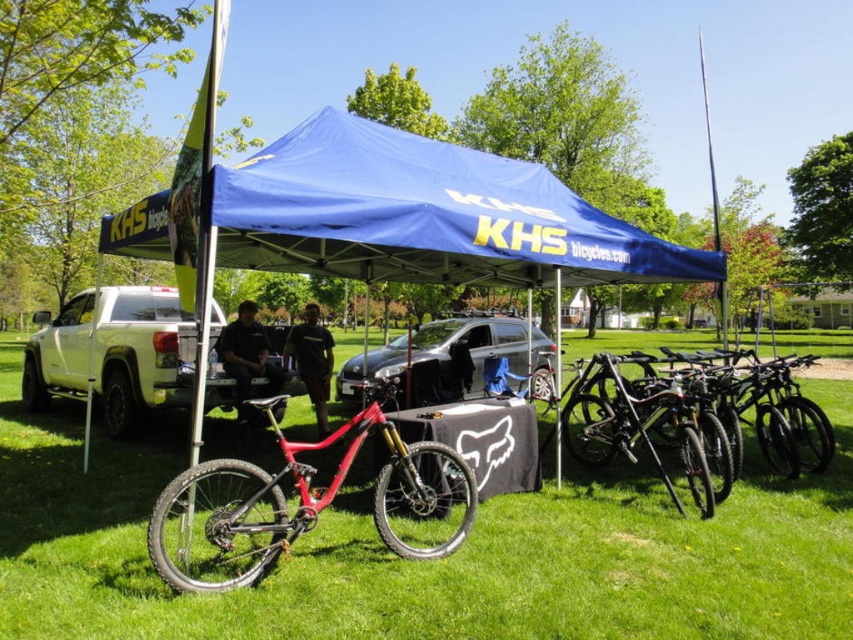
Question: Which object is farther from the camera taking this photo?

Choices:
 (A) shiny black bike at center
 (B) shiny black bike at right
 (C) green grass at center

Answer: (B)

Question: Which object is positioned farthest from the green grass at center?

Choices:
 (A) blue fabric canopy at center
 (B) shiny black bike at center
 (C) shiny red bike at center
 (D) shiny black bike at right

Answer: (A)

Question: Based on their relative distances, which object is farther from the shiny black bike at center?

Choices:
 (A) blue fabric canopy at center
 (B) shiny red bike at center

Answer: (B)

Question: Does shiny black bike at right appear over shiny red bike at center?

Choices:
 (A) yes
 (B) no

Answer: (A)

Question: In this image, where is blue fabric canopy at center located relative to shiny red bike at center?

Choices:
 (A) left
 (B) right

Answer: (B)

Question: Does green grass at center have a smaller size compared to shiny black bike at center?

Choices:
 (A) yes
 (B) no

Answer: (B)